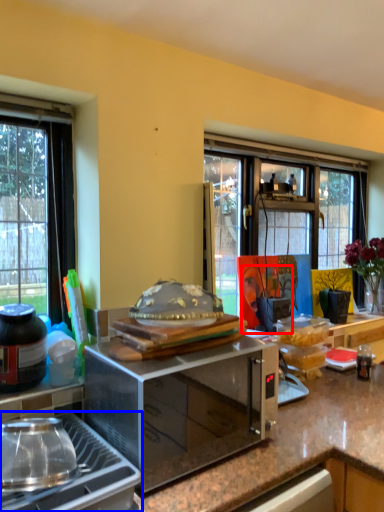
Question: Which of the following is the farthest to the observer, person (highlighted by a red box) or gas stove (highlighted by a blue box)?

Choices:
 (A) person
 (B) gas stove

Answer: (A)